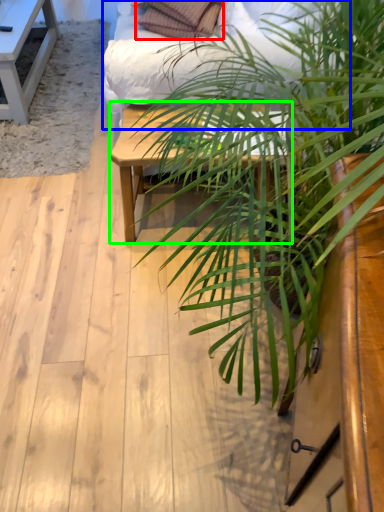
Question: Which object is positioned farthest from pillow (highlighted by a red box)? Select from bed frame (highlighted by a blue box) and table (highlighted by a green box).

Choices:
 (A) bed frame
 (B) table

Answer: (B)